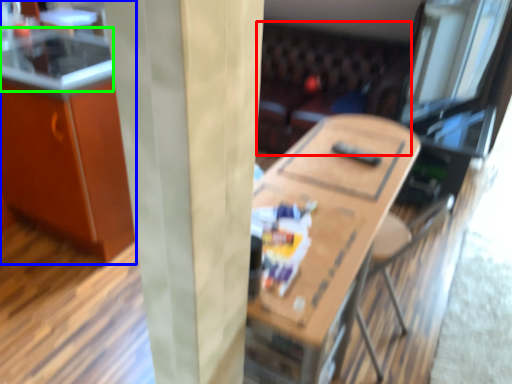
Question: Which object is positioned closest to couch (highlighted by a red box)? Select from cabinetry (highlighted by a blue box) and counter top (highlighted by a green box).

Choices:
 (A) cabinetry
 (B) counter top

Answer: (A)